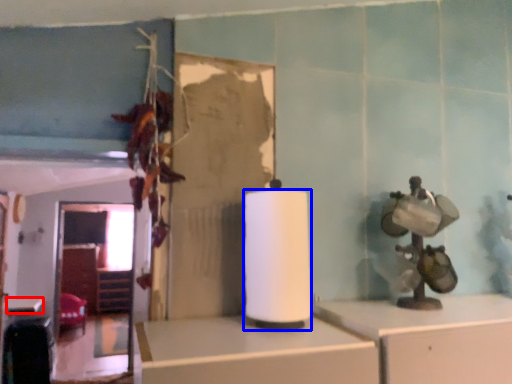
Question: Which of the following is the closest to the observer, table (highlighted by a red box) or paper towel (highlighted by a blue box)?

Choices:
 (A) table
 (B) paper towel

Answer: (B)